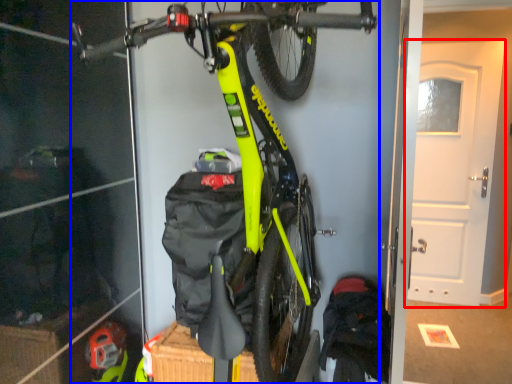
Question: Among these objects, which one is nearest to the camera, door (highlighted by a red box) or bicycle (highlighted by a blue box)?

Choices:
 (A) door
 (B) bicycle

Answer: (B)